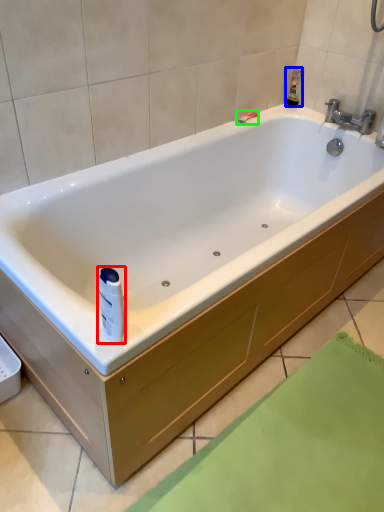
Question: Estimate the real-world distances between objects in this image. Which object is farther from toiletry (highlighted by a red box), toiletry (highlighted by a blue box) or shower (highlighted by a green box)?

Choices:
 (A) toiletry
 (B) shower

Answer: (A)